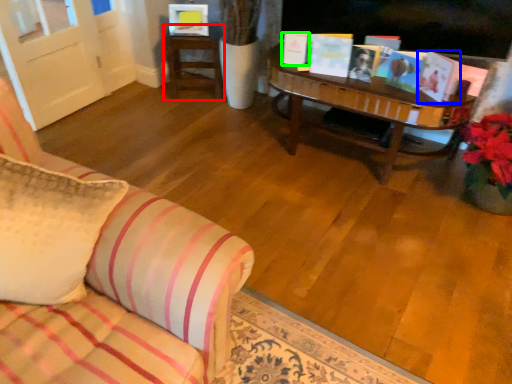
Question: Which object is positioned farthest from table (highlighted by a red box)? Select from book (highlighted by a blue box) and book (highlighted by a green box).

Choices:
 (A) book
 (B) book

Answer: (A)